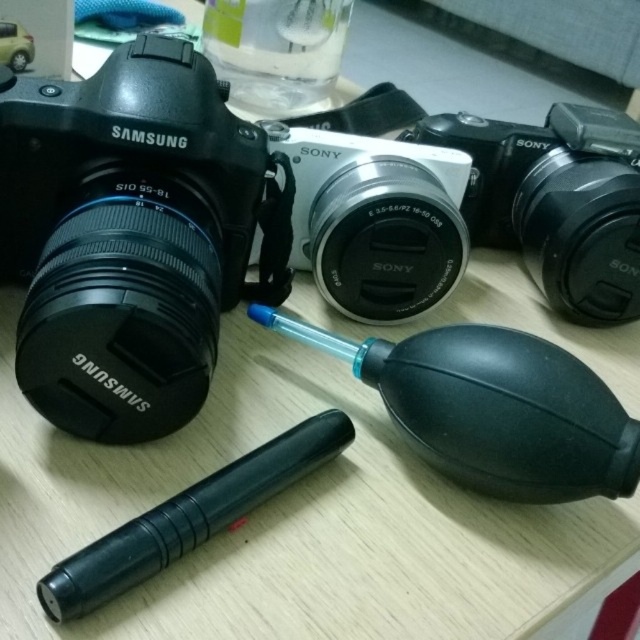
Does point (349, 170) come farther from viewer compared to point (182, 492)?

That is True.

Can you confirm if silver metallic camera at center is bigger than black rubber pen at lower left?

Indeed, silver metallic camera at center has a larger size compared to black rubber pen at lower left.

Where is `silver metallic camera at center`? silver metallic camera at center is located at coordinates (374, 220).

From the picture: Between matte black camera at left and black rubber pen at lower left, which one is positioned higher?

matte black camera at left is above.

Is point (301, 193) closer to camera compared to point (129, 568)?

No, (301, 193) is further to viewer.

I want to click on matte black camera at left, so click(x=193, y=230).

Locate an element on the screen. The width and height of the screenshot is (640, 640). matte black camera at left is located at coordinates (193, 230).

Can you confirm if black plastic camera at center is wider than black rubber pen at lower left?

Correct, the width of black plastic camera at center exceeds that of black rubber pen at lower left.

Identify the location of black plastic camera at center. The image size is (640, 640). (556, 202).

Where is `black plastic camera at center`? The image size is (640, 640). black plastic camera at center is located at coordinates (556, 202).